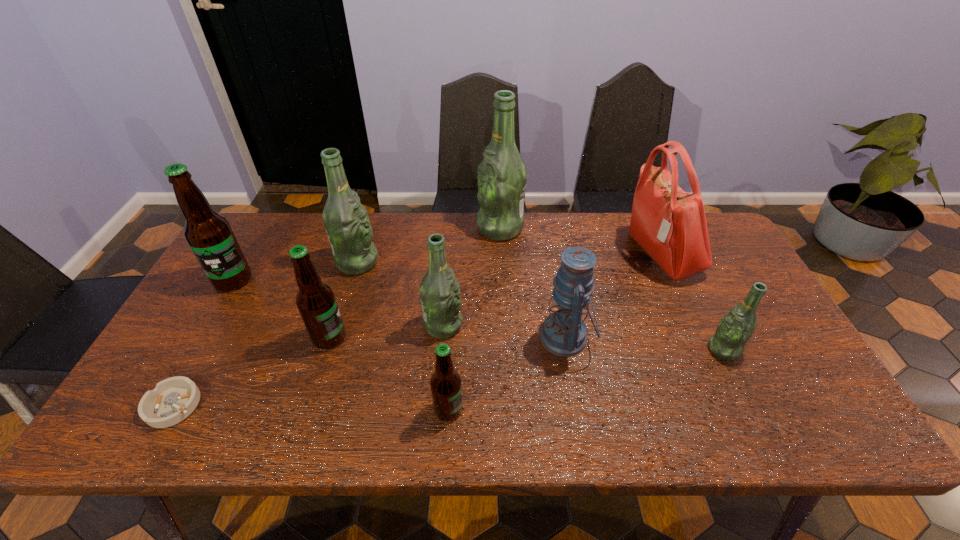
Where is `green beer bottle that stands as the closest to the second nearest brown beer bottle`? green beer bottle that stands as the closest to the second nearest brown beer bottle is located at coordinates (346, 221).

Identify which green beer bottle is the second closest to the nearest beer bottle. Please provide its 2D coordinates. Your answer should be formatted as a tuple, i.e. [(x, y)], where the tuple contains the x and y coordinates of a point satisfying the conditions above.

[(346, 221)]

You are a GUI agent. You are given a task and a screenshot of the screen. Output one action in this format:
    pyautogui.click(x=<x>, y=<y>)
    Task: Click on the third closest brown beer bottle to the leftmost green beer bottle
    
    Given the screenshot: What is the action you would take?
    pyautogui.click(x=446, y=388)

The height and width of the screenshot is (540, 960). In order to click on brown beer bottle that stands as the second closest to the fourth object from right to left in this screenshot , I will do `click(446, 388)`.

You are a GUI agent. You are given a task and a screenshot of the screen. Output one action in this format:
    pyautogui.click(x=<x>, y=<y>)
    Task: Click on the free space that satisfies the following two spatial constraints: 1. on the label of the shortest object; 2. on the left side of the farthest brown beer bottle
    
    Given the screenshot: What is the action you would take?
    pyautogui.click(x=161, y=406)

Identify the location of free space that satisfies the following two spatial constraints: 1. on the front-facing side of the handbag; 2. on the label of the biggest brown beer bottle. (672, 280).